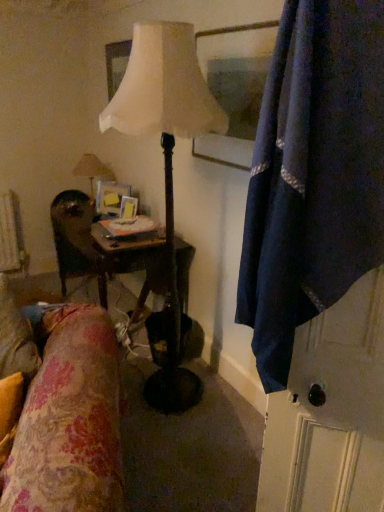
From the picture: Measure the distance between wooden glossy picture frame at center and camera.

The depth of wooden glossy picture frame at center is 2.62 meters.

Identify the location of navy blue fabric at right. (313, 175).

Where is `matte white lamp at center, marked as the 1th lamp in a right-to-left arrangement`? The width and height of the screenshot is (384, 512). matte white lamp at center, marked as the 1th lamp in a right-to-left arrangement is located at coordinates (166, 161).

What is the approximate height of floral fabric at lower left?

It is 33.16 inches.

This screenshot has width=384, height=512. Identify the location of wooden glossy picture frame at center. pyautogui.click(x=128, y=208).

From their relative heights in the image, would you say wooden glossy picture frame at center is taller or shorter than navy blue fabric at right?

In the image, wooden glossy picture frame at center appears to be shorter than navy blue fabric at right.

Considering the sizes of wooden glossy picture frame at center and navy blue fabric at right in the image, is wooden glossy picture frame at center wider or thinner than navy blue fabric at right?

wooden glossy picture frame at center is thinner than navy blue fabric at right.

From the image's perspective, is wooden glossy picture frame at center below navy blue fabric at right?

Incorrect, from the image's perspective, wooden glossy picture frame at center is higher than navy blue fabric at right.

Is navy blue fabric at right inside wooden glossy picture frame at center?

No, navy blue fabric at right is not inside wooden glossy picture frame at center.

Which of these two, wooden chair at left or floral fabric at lower left, is thinner?

wooden chair at left.

Would you say floral fabric at lower left is part of wooden chair at left's contents?

Actually, floral fabric at lower left is outside wooden chair at left.

The image size is (384, 512). I want to click on bedding below the wooden chair at left (from the image's perspective), so click(x=70, y=421).

Which is more to the left, wooden chair at left or floral fabric at lower left?

From the viewer's perspective, wooden chair at left appears more on the left side.

In the scene shown: Does floral fabric at lower left appear on the left side of navy blue fabric at right?

Correct, you'll find floral fabric at lower left to the left of navy blue fabric at right.

Considering the positions of point (70, 456) and point (284, 298), is point (70, 456) closer or farther from the camera than point (284, 298)?

Point (70, 456) appears to be farther away from the viewer than point (284, 298).

From a real-world perspective, is floral fabric at lower left on top of navy blue fabric at right?

No, from a real-world perspective, floral fabric at lower left is not on top of navy blue fabric at right.

Is floral fabric at lower left next to navy blue fabric at right?

They are not placed beside each other.

Is wooden chair at left inside navy blue fabric at right?

That's incorrect, wooden chair at left is not inside navy blue fabric at right.

Is point (365, 90) positioned after point (91, 258)?

That is False.

Which of these two, navy blue fabric at right or wooden chair at left, stands taller?

Standing taller between the two is navy blue fabric at right.

From a real-world perspective, is navy blue fabric at right physically located above or below wooden chair at left?

Clearly, from a real-world perspective, navy blue fabric at right is above wooden chair at left.

Is matte beige lamp at upper left, which is the 1th lamp in left-to-right order, outside of wooden glossy picture frame at center?

Yes, matte beige lamp at upper left, which is the 1th lamp in left-to-right order, is not within wooden glossy picture frame at center.

Does point (88, 178) appear closer or farther from the camera than point (120, 211)?

Clearly, point (88, 178) is more distant from the camera than point (120, 211).

Is matte beige lamp at upper left, which is the first lamp from back to front, bigger than wooden glossy picture frame at center?

Yes, matte beige lamp at upper left, which is the first lamp from back to front, is bigger than wooden glossy picture frame at center.

From a real-world perspective, does wooden glossy picture frame at center sit lower than matte beige lamp at upper left, placed as the second lamp when sorted from front to back?

Correct, in the physical world, wooden glossy picture frame at center is lower than matte beige lamp at upper left, placed as the second lamp when sorted from front to back.

Considering the sizes of wooden glossy picture frame at center and matte beige lamp at upper left, which is the 1th lamp in left-to-right order, in the image, is wooden glossy picture frame at center wider or thinner than matte beige lamp at upper left, which is the 1th lamp in left-to-right order,?

Considering their sizes, wooden glossy picture frame at center looks slimmer than matte beige lamp at upper left, which is the 1th lamp in left-to-right order.

From the image's perspective, is wooden glossy picture frame at center under matte beige lamp at upper left, which is the 1th lamp in left-to-right order?

Yes, from the image's perspective, wooden glossy picture frame at center is beneath matte beige lamp at upper left, which is the 1th lamp in left-to-right order.

Is point (125, 208) closer or farther from the camera than point (102, 169)?

Point (125, 208).

Considering the relative sizes of matte beige lamp at upper left, placed as the second lamp when sorted from front to back, and wooden chair at left in the image provided, is matte beige lamp at upper left, placed as the second lamp when sorted from front to back, wider than wooden chair at left?

Indeed, matte beige lamp at upper left, placed as the second lamp when sorted from front to back, has a greater width compared to wooden chair at left.

Who is shorter, matte beige lamp at upper left, placed as the second lamp when sorted from front to back, or wooden chair at left?

With less height is matte beige lamp at upper left, placed as the second lamp when sorted from front to back.

Is matte beige lamp at upper left, placed as the second lamp when sorted from front to back, to the right of wooden chair at left from the viewer's perspective?

Yes, matte beige lamp at upper left, placed as the second lamp when sorted from front to back, is to the right of wooden chair at left.

How much distance is there between matte beige lamp at upper left, placed as the second lamp when sorted from front to back, and wooden chair at left?

matte beige lamp at upper left, placed as the second lamp when sorted from front to back, is 17.61 inches from wooden chair at left.

Locate an element on the screen. picture frame located underneath the navy blue fabric at right (from a real-world perspective) is located at coordinates (128, 208).

The image size is (384, 512). What are the coordinates of `bedding below the wooden chair at left (from the image's perspective)` in the screenshot? It's located at (70, 421).

From the picture: Estimate the real-world distances between objects in this image. Which object is closer to matte beige lamp at upper left, which is the 1th lamp in left-to-right order, wooden glossy picture frame at center or matte white lamp at center, positioned as the 2th lamp in left-to-right order?

wooden glossy picture frame at center.

From the image, which object appears to be farther from floral fabric at lower left, wooden glossy picture frame at center or navy blue fabric at right?

Among the two, wooden glossy picture frame at center is located further to floral fabric at lower left.

Considering their positions, is matte beige lamp at upper left, placed as the second lamp when sorted from front to back, positioned further to wooden chair at left than navy blue fabric at right?

navy blue fabric at right lies further to wooden chair at left than the other object.

From the image, which object appears to be farther from matte white lamp at center, acting as the second lamp starting from the back, matte beige lamp at upper left, placed as the second lamp when sorted from right to left, or wooden glossy picture frame at center?

matte beige lamp at upper left, placed as the second lamp when sorted from right to left.

From the picture: Which object lies further to the anchor point wooden glossy picture frame at center, matte white lamp at center, marked as the 1th lamp in a right-to-left arrangement, or floral fabric at lower left?

The object further to wooden glossy picture frame at center is floral fabric at lower left.

Looking at the image, which one is located closer to matte white lamp at center, marked as the 1th lamp in a right-to-left arrangement, floral fabric at lower left or matte beige lamp at upper left, which is the first lamp from back to front?

Based on the image, floral fabric at lower left appears to be nearer to matte white lamp at center, marked as the 1th lamp in a right-to-left arrangement.

Considering their positions, is navy blue fabric at right positioned closer to matte white lamp at center, arranged as the first lamp when viewed from the front, than wooden glossy picture frame at center?

The object closer to matte white lamp at center, arranged as the first lamp when viewed from the front, is navy blue fabric at right.

Looking at this image, which object lies nearer to the anchor point navy blue fabric at right, matte beige lamp at upper left, which is the first lamp from back to front, or wooden chair at left?

Based on the image, wooden chair at left appears to be nearer to navy blue fabric at right.

I want to click on picture frame between navy blue fabric at right and wooden chair at left along the z-axis, so point(128,208).

Image resolution: width=384 pixels, height=512 pixels. What are the coordinates of `picture frame located between matte white lamp at center, positioned as the 2th lamp in left-to-right order, and matte beige lamp at upper left, which is the 1th lamp in left-to-right order, in the depth direction` in the screenshot? It's located at (128, 208).

Where is `curtain between floral fabric at lower left and matte beige lamp at upper left, which is the first lamp from back to front, along the z-axis`? The image size is (384, 512). curtain between floral fabric at lower left and matte beige lamp at upper left, which is the first lamp from back to front, along the z-axis is located at coordinates (313, 175).

Identify the location of lamp positioned between floral fabric at lower left and wooden glossy picture frame at center from near to far. The width and height of the screenshot is (384, 512). (166, 161).